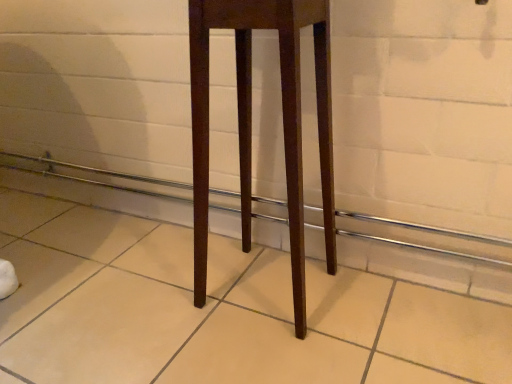
Where is `free region under mahogany wood stool at center (from a real-world perspective)`? The width and height of the screenshot is (512, 384). free region under mahogany wood stool at center (from a real-world perspective) is located at coordinates (264, 295).